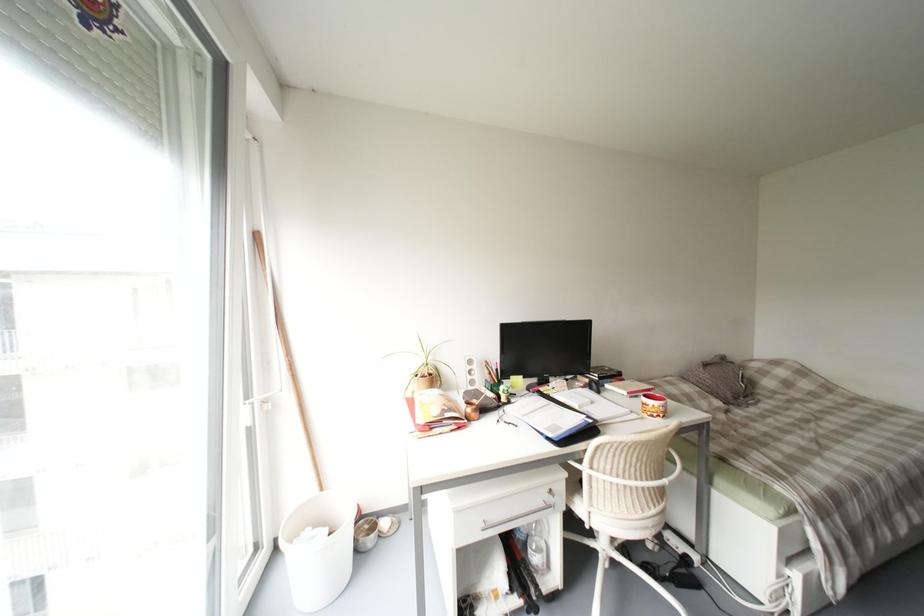
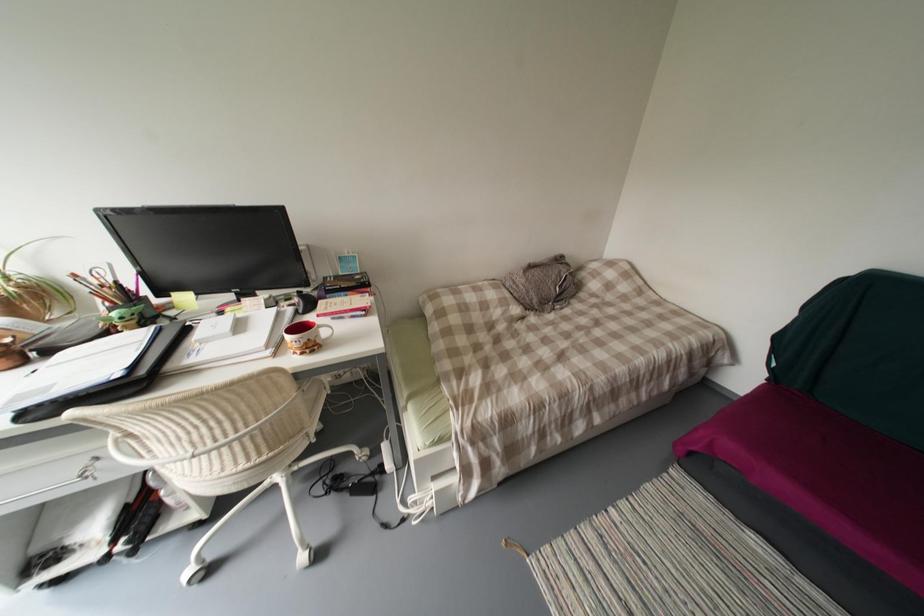
Question: Which direction would the cameraman need to move to produce the second image? Reply with the corresponding letter.

Choices:
 (A) Left
 (B) Right
 (C) Forward
 (D) Backward

Answer: (B)